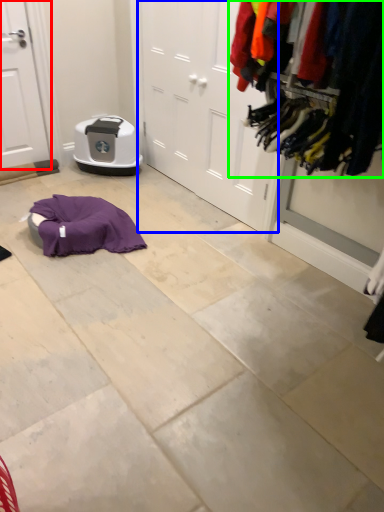
Question: Which is farther away from door (highlighted by a red box)? door (highlighted by a blue box) or closet (highlighted by a green box)?

Choices:
 (A) door
 (B) closet

Answer: (B)